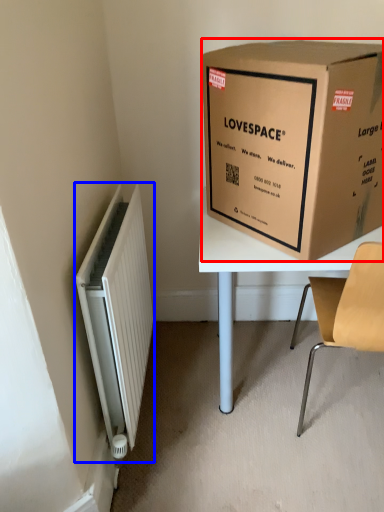
Question: Which object appears closest to the camera in this image, box (highlighted by a red box) or radiator (highlighted by a blue box)?

Choices:
 (A) box
 (B) radiator

Answer: (A)